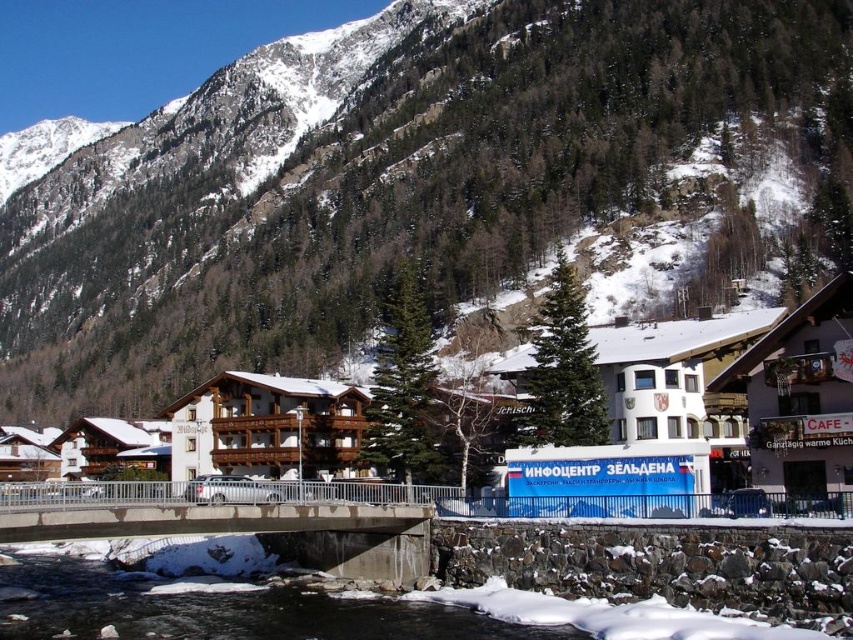
Question: Which object is farther from the camera taking this photo?

Choices:
 (A) wooden cabin at center
 (B) clear water at center

Answer: (A)

Question: Which object is the closest to the snowy rock at upper center?

Choices:
 (A) concrete bridge at center
 (B) wooden cabin at center
 (C) clear water at center
 (D) white wooden chalet at center

Answer: (D)

Question: Is clear water at center bigger than wooden cabin at center?

Choices:
 (A) no
 (B) yes

Answer: (B)

Question: Is the position of snowy rock at upper center less distant than that of wooden cabin at center?

Choices:
 (A) no
 (B) yes

Answer: (A)

Question: Can you confirm if white wooden building at right is bigger than wooden cabin at center?

Choices:
 (A) yes
 (B) no

Answer: (B)

Question: Which is nearer to the snowy rock at upper center?

Choices:
 (A) clear water at center
 (B) white wooden chalet at center
 (C) concrete bridge at center

Answer: (B)